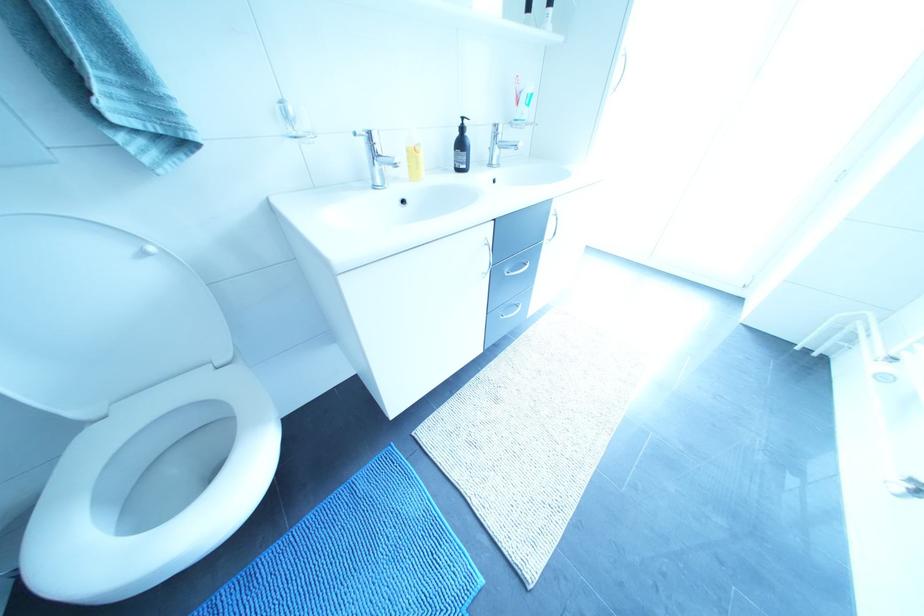
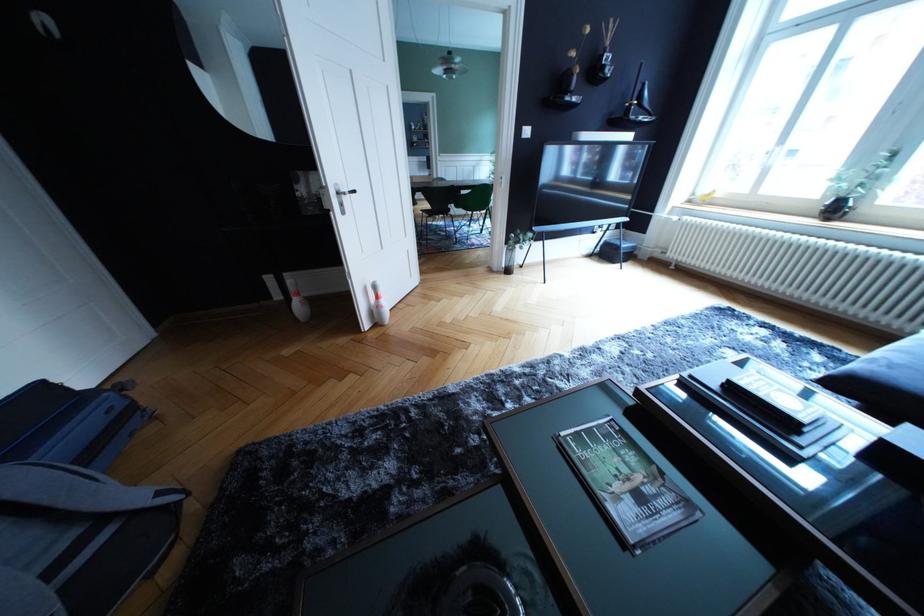
Question: I am providing you with two images of the same scene from different viewpoints. Which of the following objects are not visible in image2?

Choices:
 (A) red and black box
 (B) black wall vase
 (C) glass vase
 (D) clear toothbrush cup

Answer: (D)